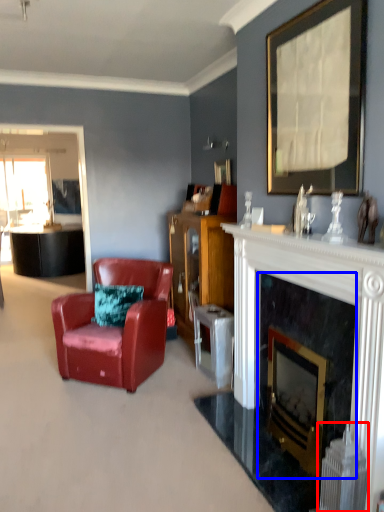
Question: Which of the following is the farthest to the observer, radiator (highlighted by a red box) or fireplace (highlighted by a blue box)?

Choices:
 (A) radiator
 (B) fireplace

Answer: (B)